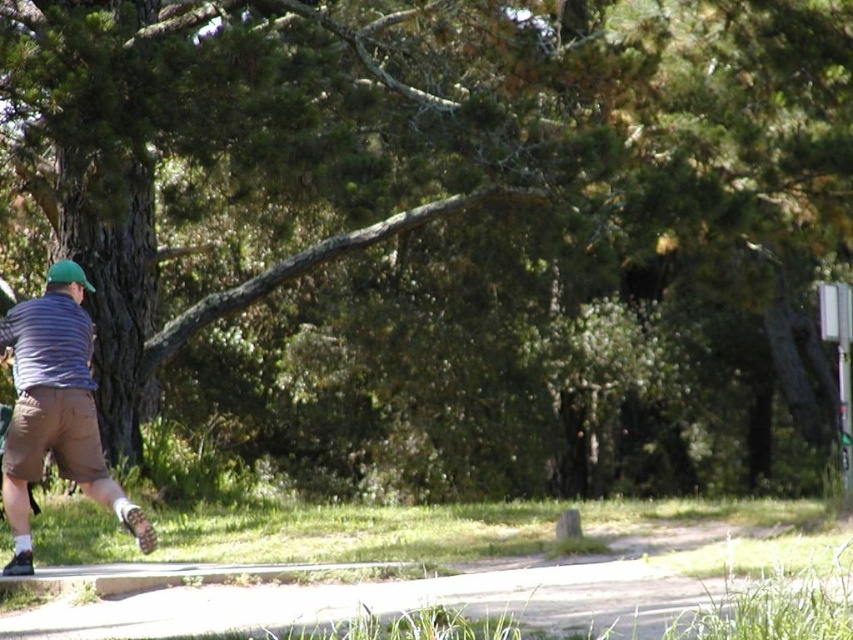
You are a photographer standing at the end of the paved pathway. You want to take a photo of the striped cotton shirt at left and the green grass at lower center. Which object will appear closer to the camera in the photo?

The green grass at lower center will appear closer to the camera because it is in front of the striped cotton shirt at left in the scene.

You are a photographer standing at the end of the paved pathway that curves to the right. You want to take a photo of the striped cotton shirt at left and the green grass at lower center. Which object will appear closer to the bottom of your photo?

The green grass at lower center will appear closer to the bottom of the photo because it is shorter than the striped cotton shirt at left.

You are standing on the paved pathway in the park and see the striped cotton shirt at left and the green grass at lower center. Which object is positioned more to the right from your perspective?

The green grass at lower center is positioned more to the right compared to the striped cotton shirt at left.